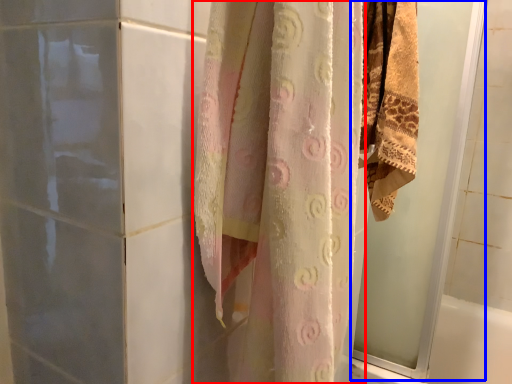
Question: Among these objects, which one is farthest to the camera, curtain (highlighted by a red box) or screen door (highlighted by a blue box)?

Choices:
 (A) curtain
 (B) screen door

Answer: (B)